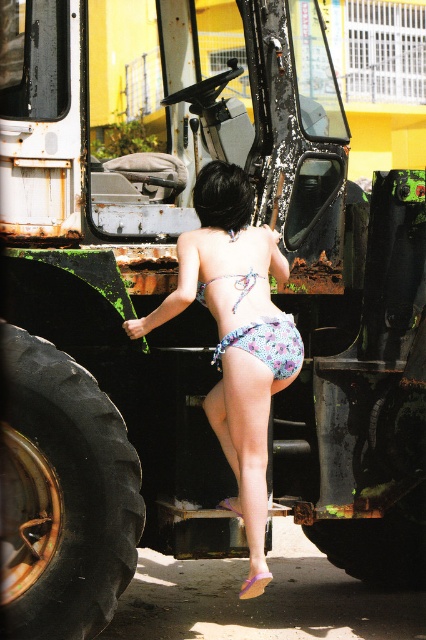
Is floral print fabric bikini bottom at center bigger than translucent floral bikini top at center?

Yes, floral print fabric bikini bottom at center is bigger than translucent floral bikini top at center.

Between floral print fabric bikini bottom at center and translucent floral bikini top at center, which one has more height?

floral print fabric bikini bottom at center is taller.

Identify the location of floral print fabric bikini bottom at center. Image resolution: width=426 pixels, height=640 pixels. (267, 342).

Is black rubber tire at lower left above floral print fabric bikini bottom at center?

Actually, black rubber tire at lower left is below floral print fabric bikini bottom at center.

Identify the location of black rubber tire at lower left. (63, 497).

This screenshot has height=640, width=426. Identify the location of black rubber tire at lower left. (63, 497).

Is black rubber tire at lower left shorter than translucent floral bikini top at center?

Incorrect, black rubber tire at lower left's height does not fall short of translucent floral bikini top at center's.

Between point (20, 582) and point (233, 276), which one is positioned in front?

Point (20, 582)

You are a GUI agent. You are given a task and a screenshot of the screen. Output one action in this format:
    pyautogui.click(x=<x>, y=<y>)
    Task: Click on the black rubber tire at lower left
    This screenshot has height=640, width=426.
    Given the screenshot: What is the action you would take?
    pyautogui.click(x=63, y=497)